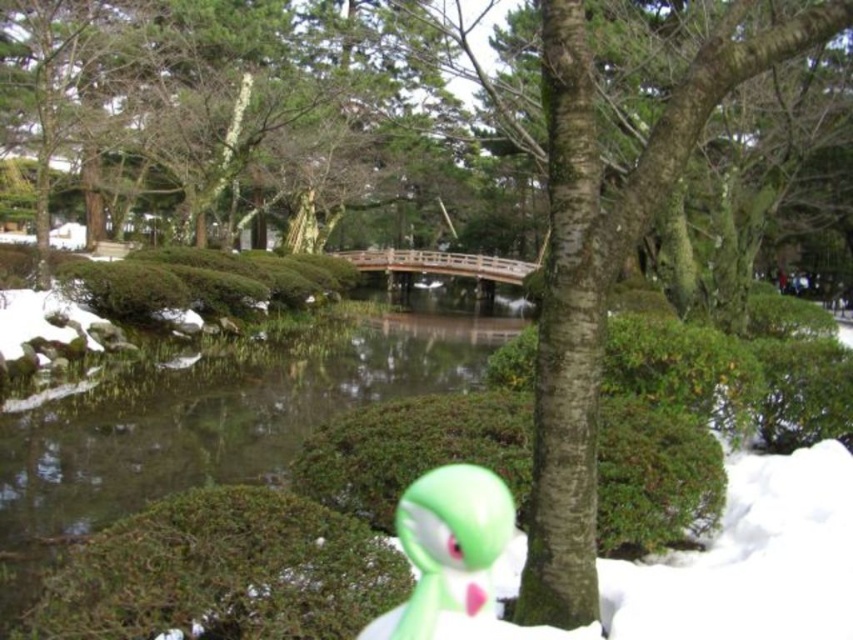
What do you see at coordinates (215, 429) in the screenshot? I see `clear water at center` at bounding box center [215, 429].

Is clear water at center shorter than green matte toy at center?

In fact, clear water at center may be taller than green matte toy at center.

Does point (326, 400) lie in front of point (451, 556)?

No, (326, 400) is behind (451, 556).

Find the location of `clear water at center`. clear water at center is located at coordinates (215, 429).